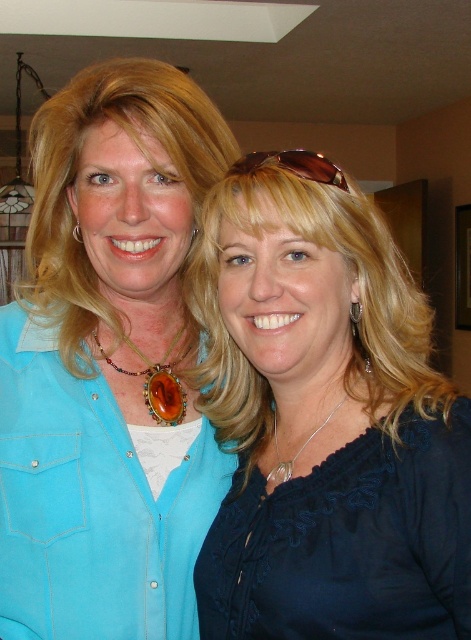
Can you confirm if amber stone necklace at center is bigger than silver metallic necklace at center?

Incorrect, amber stone necklace at center is not larger than silver metallic necklace at center.

Between point (131, 348) and point (267, 486), which one is positioned behind?

The point (131, 348) is behind.

At what (x,y) coordinates should I click in order to perform the action: click on amber stone necklace at center. Please return your answer as a coordinate pair (x, y). Image resolution: width=471 pixels, height=640 pixels. Looking at the image, I should click on (156, 380).

Can you confirm if matte blue shirt at center is positioned to the left of amber stone necklace at center?

Indeed, matte blue shirt at center is positioned on the left side of amber stone necklace at center.

Which of these two, matte blue shirt at center or amber stone necklace at center, stands taller?

With more height is matte blue shirt at center.

Who is more forward, (200, 440) or (172, 339)?

Point (200, 440)

Find the location of a particular element. Image resolution: width=471 pixels, height=640 pixels. matte blue shirt at center is located at coordinates (108, 364).

Is satin navy blouse at center further to the viewer compared to brown leather sunglasses at upper center?

No.

Can you confirm if satin navy blouse at center is wider than brown leather sunglasses at upper center?

Indeed, satin navy blouse at center has a greater width compared to brown leather sunglasses at upper center.

This screenshot has width=471, height=640. I want to click on satin navy blouse at center, so click(325, 422).